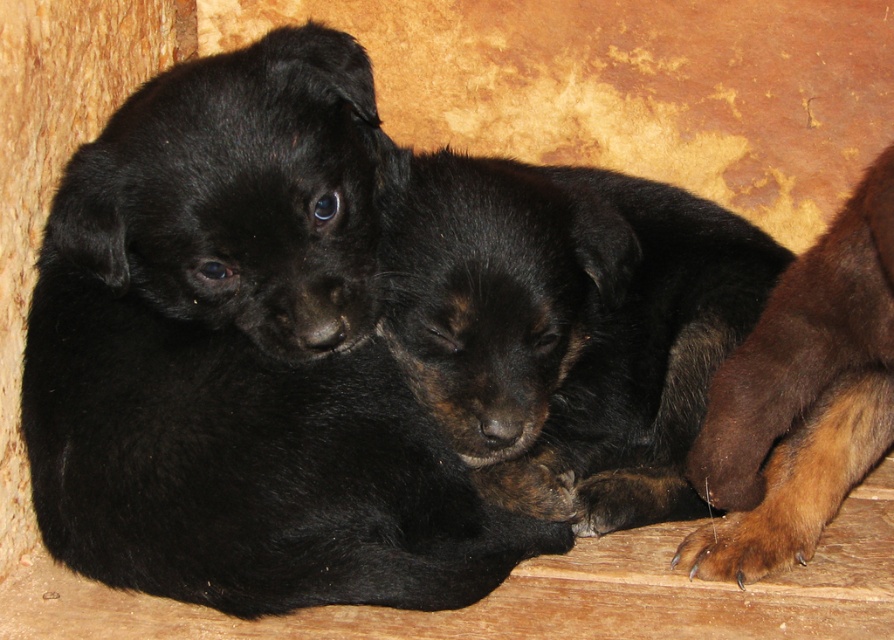
You are a dog trainer observing two puppies in a wooden area. You need to determine which puppy has a larger width. The puppies are the black fur dog at center and the black fur puppy at upper left. Which one is wider?

The black fur dog at center has a greater width than the black fur puppy at upper left according to the description.

You are observing two puppies in the image. Based on their positions, which one is located higher up, the black fur dog at center or the black fur puppy at upper left?

The black fur puppy at upper left is higher up because it is positioned above the black fur dog at center.